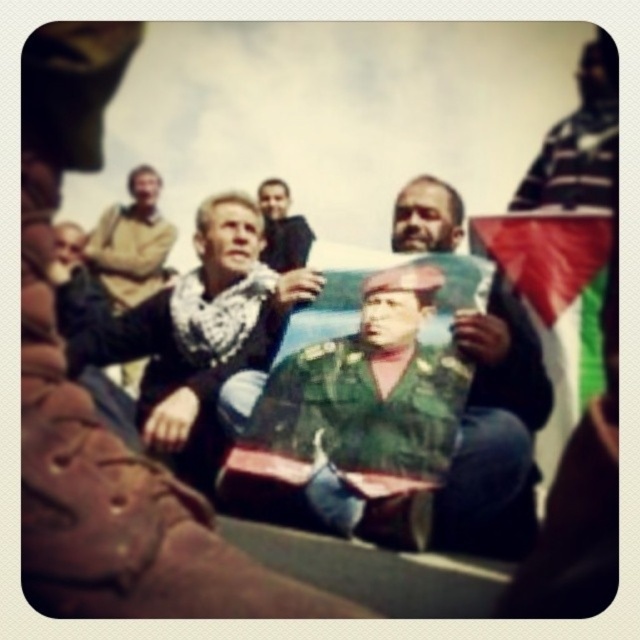
Question: Does camouflage uniform at center appear over green fabric flag at center?

Choices:
 (A) no
 (B) yes

Answer: (B)

Question: Does green military uniform at center have a larger size compared to light brown leather jacket at upper left?

Choices:
 (A) no
 (B) yes

Answer: (A)

Question: Which object is farther from the camera taking this photo?

Choices:
 (A) dark green uniform at center
 (B) green fabric flag at center

Answer: (A)

Question: Is camouflage uniform at center above dark green uniform at center?

Choices:
 (A) yes
 (B) no

Answer: (B)

Question: Which object is the farthest from the green military uniform at center?

Choices:
 (A) green fabric flag at center
 (B) dark green uniform at center
 (C) camouflage uniform at center

Answer: (B)

Question: Which is nearer to the green fabric flag at center?

Choices:
 (A) green military uniform at center
 (B) dark green uniform at center
 (C) light brown leather jacket at upper left

Answer: (A)